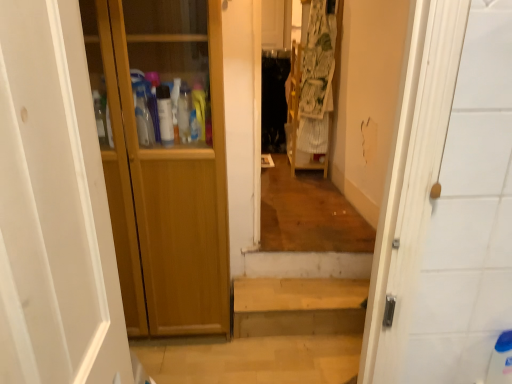
Question: Is wooden cabinet at left at the back of wooden stairs at center?

Choices:
 (A) yes
 (B) no

Answer: (B)

Question: From the image's perspective, does wooden stairs at center appear lower than wooden cabinet at left?

Choices:
 (A) no
 (B) yes

Answer: (B)

Question: Does wooden stairs at center have a lesser width compared to wooden cabinet at left?

Choices:
 (A) no
 (B) yes

Answer: (B)

Question: From a real-world perspective, is wooden stairs at center positioned over wooden cabinet at left based on gravity?

Choices:
 (A) yes
 (B) no

Answer: (B)

Question: From the image's perspective, does wooden stairs at center appear higher than wooden cabinet at left?

Choices:
 (A) yes
 (B) no

Answer: (B)

Question: Which is correct: wooden cabinet at left is inside wooden cabinet at left, or outside of it?

Choices:
 (A) outside
 (B) inside

Answer: (A)

Question: In the image, is wooden cabinet at left on the left side or the right side of wooden cabinet at left?

Choices:
 (A) left
 (B) right

Answer: (B)

Question: Looking at the image, does wooden cabinet at left seem bigger or smaller compared to wooden cabinet at left?

Choices:
 (A) small
 (B) big

Answer: (A)

Question: Looking at their shapes, would you say wooden cabinet at left is wider or thinner than wooden cabinet at left?

Choices:
 (A) thin
 (B) wide

Answer: (B)

Question: From their relative heights in the image, would you say wooden stairs at center is taller or shorter than printed fabric laundry at center?

Choices:
 (A) tall
 (B) short

Answer: (B)

Question: Is wooden stairs at center situated inside printed fabric laundry at center or outside?

Choices:
 (A) outside
 (B) inside

Answer: (A)

Question: Is wooden stairs at center in front of or behind printed fabric laundry at center in the image?

Choices:
 (A) behind
 (B) front

Answer: (B)

Question: Is point (297, 296) closer or farther from the camera than point (309, 39)?

Choices:
 (A) farther
 (B) closer

Answer: (B)

Question: Looking at their shapes, would you say wooden stairs at center is wider or thinner than wooden cabinet at left?

Choices:
 (A) wide
 (B) thin

Answer: (B)

Question: Do you think wooden stairs at center is within wooden cabinet at left, or outside of it?

Choices:
 (A) outside
 (B) inside

Answer: (A)